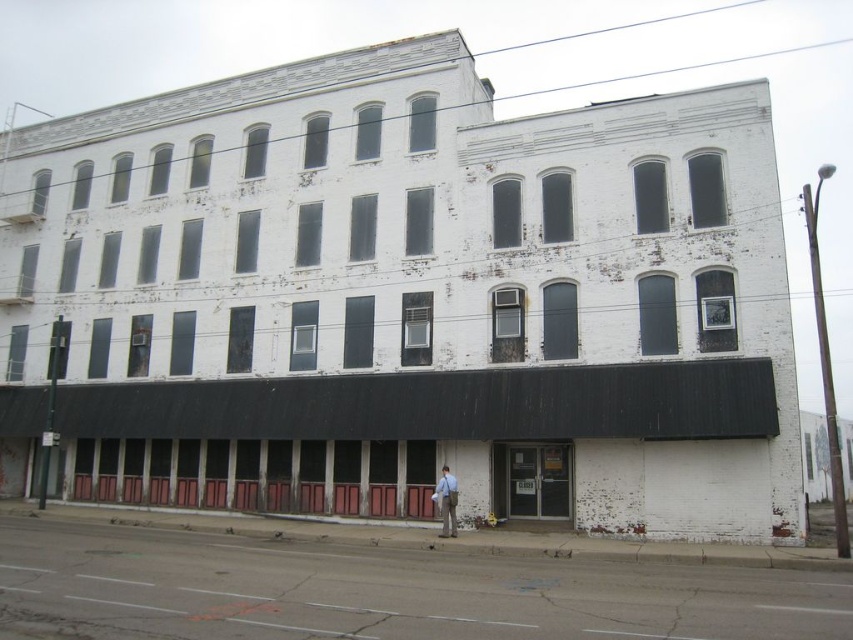
Does matte glass door at lower center appear on the left side of light brown leather jacket at center?

In fact, matte glass door at lower center is to the right of light brown leather jacket at center.

Does matte glass door at lower center have a larger size compared to light brown leather jacket at center?

Yes.

Between point (525, 500) and point (445, 508), which one is positioned in front?

Point (445, 508) is in front.

Where is `matte glass door at lower center`? This screenshot has height=640, width=853. matte glass door at lower center is located at coordinates (531, 481).